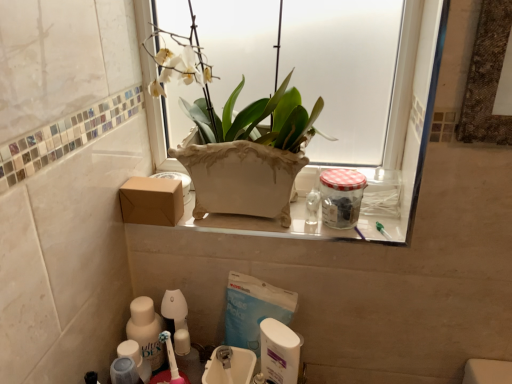
Question: Does clear glass jar at upper right lie in front of translucent plastic bottle at lower left, which is the 1th cleaning product in left-to-right order?

Choices:
 (A) yes
 (B) no

Answer: (A)

Question: From a real-world perspective, is clear glass jar at upper right below translucent plastic bottle at lower left, the 2th cleaning product positioned from the right?

Choices:
 (A) no
 (B) yes

Answer: (A)

Question: Can you confirm if clear glass jar at upper right is positioned to the right of translucent plastic bottle at lower left, which is the 1th cleaning product in left-to-right order?

Choices:
 (A) no
 (B) yes

Answer: (B)

Question: Can you confirm if clear glass jar at upper right is shorter than translucent plastic bottle at lower left, which is the 1th cleaning product in left-to-right order?

Choices:
 (A) yes
 (B) no

Answer: (A)

Question: Are clear glass jar at upper right and translucent plastic bottle at lower left, the 2th cleaning product positioned from the right, making contact?

Choices:
 (A) yes
 (B) no

Answer: (B)

Question: In terms of width, does white plastic sink at lower center, which ranks as the 2th sink in front-to-back order, look wider or thinner when compared to white glossy ceramic vase at upper center?

Choices:
 (A) wide
 (B) thin

Answer: (B)

Question: Is white plastic sink at lower center, which is the first sink from back to front, inside the boundaries of white glossy ceramic vase at upper center, or outside?

Choices:
 (A) inside
 (B) outside

Answer: (B)

Question: In the image, is white plastic sink at lower center, which ranks as the 2th sink in front-to-back order, positioned in front of or behind white glossy ceramic vase at upper center?

Choices:
 (A) behind
 (B) front

Answer: (A)

Question: Is point (293, 345) closer or farther from the camera than point (248, 213)?

Choices:
 (A) closer
 (B) farther

Answer: (A)

Question: In terms of width, does white glossy ceramic vase at upper center look wider or thinner when compared to translucent plastic bottle at lower left, which is the 1th cleaning product in left-to-right order?

Choices:
 (A) wide
 (B) thin

Answer: (A)

Question: From a real-world perspective, is white glossy ceramic vase at upper center positioned above or below translucent plastic bottle at lower left, the 2th cleaning product positioned from the right?

Choices:
 (A) below
 (B) above

Answer: (B)

Question: Is white glossy ceramic vase at upper center to the left or to the right of translucent plastic bottle at lower left, which is the 1th cleaning product in left-to-right order, in the image?

Choices:
 (A) right
 (B) left

Answer: (A)

Question: Is white glossy ceramic vase at upper center in front of or behind translucent plastic bottle at lower left, the 2th cleaning product positioned from the right, in the image?

Choices:
 (A) front
 (B) behind

Answer: (A)

Question: From a real-world perspective, is white plastic container at lower center, positioned as the second cleaning product in left-to-right order, physically located above or below white glossy ceramic vase at upper center?

Choices:
 (A) above
 (B) below

Answer: (B)

Question: Is point (278, 350) positioned closer to the camera than point (267, 157)?

Choices:
 (A) farther
 (B) closer

Answer: (B)